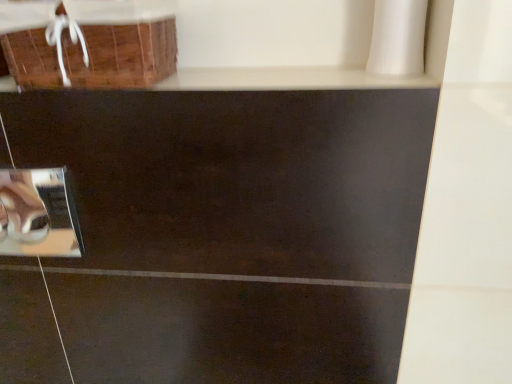
Describe the element at coordinates (38, 214) in the screenshot. I see `metallic silver mirror at lower left` at that location.

At what (x,y) coordinates should I click in order to perform the action: click on metallic silver mirror at lower left. Please return your answer as a coordinate pair (x, y). Image resolution: width=512 pixels, height=384 pixels. Looking at the image, I should click on (38, 214).

Describe the element at coordinates (122, 54) in the screenshot. I see `brown woven basket at upper left` at that location.

Where is `brown woven basket at upper left`? This screenshot has height=384, width=512. brown woven basket at upper left is located at coordinates (122, 54).

The height and width of the screenshot is (384, 512). What are the coordinates of `metallic silver mirror at lower left` in the screenshot? It's located at (38, 214).

Considering the positions of objects metallic silver mirror at lower left and brown woven basket at upper left in the image provided, who is more to the left, metallic silver mirror at lower left or brown woven basket at upper left?

Positioned to the left is metallic silver mirror at lower left.

Who is more distant, metallic silver mirror at lower left or brown woven basket at upper left?

metallic silver mirror at lower left is further away from the camera.

Considering the points (51, 235) and (144, 85), which point is in front, point (51, 235) or point (144, 85)?

The point (144, 85) is in front.

From the image's perspective, is metallic silver mirror at lower left located beneath brown woven basket at upper left?

Yes.

From a real-world perspective, is metallic silver mirror at lower left above or below brown woven basket at upper left?

metallic silver mirror at lower left is below brown woven basket at upper left.

Is metallic silver mirror at lower left wider than brown woven basket at upper left?

Incorrect, the width of metallic silver mirror at lower left does not surpass that of brown woven basket at upper left.

Considering the sizes of objects metallic silver mirror at lower left and brown woven basket at upper left in the image provided, who is shorter, metallic silver mirror at lower left or brown woven basket at upper left?

brown woven basket at upper left.

Is metallic silver mirror at lower left bigger than brown woven basket at upper left?

No, metallic silver mirror at lower left is not bigger than brown woven basket at upper left.

Is metallic silver mirror at lower left not inside brown woven basket at upper left?

Yes, metallic silver mirror at lower left is not within brown woven basket at upper left.

Would you consider metallic silver mirror at lower left to be distant from brown woven basket at upper left?

No, metallic silver mirror at lower left is not far from brown woven basket at upper left.

Could you tell me if metallic silver mirror at lower left is facing brown woven basket at upper left?

No, metallic silver mirror at lower left does not turn towards brown woven basket at upper left.

How different are the orientations of metallic silver mirror at lower left and brown woven basket at upper left in degrees?

The facing directions of metallic silver mirror at lower left and brown woven basket at upper left are 0.222 degrees apart.

Measure the distance between metallic silver mirror at lower left and brown woven basket at upper left.

metallic silver mirror at lower left and brown woven basket at upper left are 9.88 inches apart.

Image resolution: width=512 pixels, height=384 pixels. Identify the location of square behind the brown woven basket at upper left. (38, 214).

Between brown woven basket at upper left and metallic silver mirror at lower left, which one appears on the right side from the viewer's perspective?

Positioned to the right is brown woven basket at upper left.

Between brown woven basket at upper left and metallic silver mirror at lower left, which one is positioned behind?

metallic silver mirror at lower left.

Is point (55, 67) closer or farther from the camera than point (17, 202)?

Point (55, 67) is closer to the camera than point (17, 202).

From the image's perspective, is brown woven basket at upper left above metallic silver mirror at lower left?

Yes, from the image's perspective, brown woven basket at upper left is on top of metallic silver mirror at lower left.

From a real-world perspective, is brown woven basket at upper left positioned above or below metallic silver mirror at lower left?

brown woven basket at upper left is above metallic silver mirror at lower left.

Looking at their sizes, would you say brown woven basket at upper left is wider or thinner than metallic silver mirror at lower left?

Clearly, brown woven basket at upper left has more width compared to metallic silver mirror at lower left.

Does brown woven basket at upper left have a greater height compared to metallic silver mirror at lower left?

In fact, brown woven basket at upper left may be shorter than metallic silver mirror at lower left.

Considering the relative sizes of brown woven basket at upper left and metallic silver mirror at lower left in the image provided, is brown woven basket at upper left smaller than metallic silver mirror at lower left?

No, brown woven basket at upper left is not smaller than metallic silver mirror at lower left.

Would you say metallic silver mirror at lower left is part of brown woven basket at upper left's contents?

Actually, metallic silver mirror at lower left is outside brown woven basket at upper left.

Can you see brown woven basket at upper left touching metallic silver mirror at lower left?

brown woven basket at upper left is not next to metallic silver mirror at lower left, and they're not touching.

Is brown woven basket at upper left looking in the opposite direction of metallic silver mirror at lower left?

No, brown woven basket at upper left's orientation is not away from metallic silver mirror at lower left.

How different are the orientations of brown woven basket at upper left and metallic silver mirror at lower left in degrees?

They differ by 0.222 degrees in their facing directions.

This screenshot has height=384, width=512. I want to click on square that is behind the brown woven basket at upper left, so click(38, 214).

Find the location of a particular element. The height and width of the screenshot is (384, 512). basket above the metallic silver mirror at lower left (from a real-world perspective) is located at coordinates (122, 54).

Locate an element on the screen. This screenshot has width=512, height=384. square below the brown woven basket at upper left (from the image's perspective) is located at coordinates (38, 214).